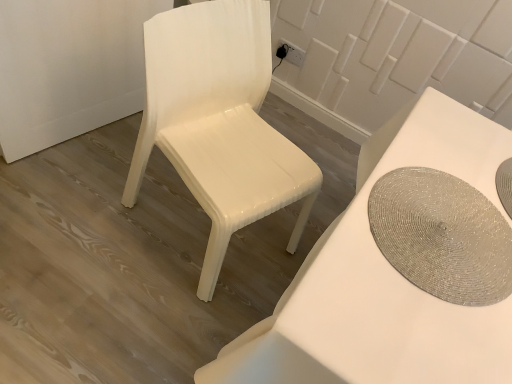
What are the coordinates of `shiny silver placemat at right` in the screenshot? It's located at (442, 236).

Locate an element on the screen. shiny silver placemat at right is located at coordinates (442, 236).

What's the angular difference between shiny silver placemat at right and white glossy chair at left's facing directions?

162 degrees.

Considering the positions of objects shiny silver placemat at right and white glossy chair at left in the image provided, who is in front, shiny silver placemat at right or white glossy chair at left?

shiny silver placemat at right.

Is shiny silver placemat at right facing towards white glossy chair at left?

Yes, shiny silver placemat at right faces towards white glossy chair at left.

Is white glossy chair at left completely or partially inside shiny silver placemat at right?

That's incorrect, white glossy chair at left is not inside shiny silver placemat at right.

Which is in front, white glossy table at center or white glossy chair at left?

white glossy table at center.

Is white glossy table at center bigger than white glossy chair at left?

Correct, white glossy table at center is larger in size than white glossy chair at left.

This screenshot has height=384, width=512. Find the location of `table to the right of white glossy chair at left`. table to the right of white glossy chair at left is located at coordinates (383, 280).

From a real-world perspective, which object stands above the other?

white glossy chair at left, from a real-world perspective.

Is white glossy chair at left far away from shiny silver placemat at right?

That's not correct — white glossy chair at left is a little close to shiny silver placemat at right.

Is point (200, 79) in front of point (486, 253)?

No, (200, 79) is further to viewer.

From a real-world perspective, is white glossy chair at left above or below white glossy table at center?

From a real-world perspective, white glossy chair at left is physically above white glossy table at center.

Considering the relative sizes of white glossy chair at left and white glossy table at center in the image provided, is white glossy chair at left taller than white glossy table at center?

Correct, white glossy chair at left is much taller as white glossy table at center.

Could white glossy table at center be considered to be inside white glossy chair at left?

No, white glossy table at center is not a part of white glossy chair at left.

Can you tell me how much white glossy chair at left and white glossy table at center differ in facing direction?

They differ by 69.4 degrees in their facing directions.

Is white glossy table at center facing away from shiny silver placemat at right?

No.

Which of these two, white glossy table at center or shiny silver placemat at right, is smaller?

With smaller size is shiny silver placemat at right.

Are white glossy table at center and shiny silver placemat at right located far from each other?

That's not correct — white glossy table at center is a little close to shiny silver placemat at right.

From a real-world perspective, does white glossy table at center stand above shiny silver placemat at right?

No, from a real-world perspective, white glossy table at center is not over shiny silver placemat at right

Considering the relative sizes of shiny silver placemat at right and white glossy table at center in the image provided, is shiny silver placemat at right smaller than white glossy table at center?

Indeed, shiny silver placemat at right has a smaller size compared to white glossy table at center.

Is white glossy table at center inside shiny silver placemat at right?

No, white glossy table at center is not surrounded by shiny silver placemat at right.

From a real-world perspective, which object stands above the other?

In real-world perspective, shiny silver placemat at right is above.

Which is closer to the camera, [437,234] or [258,374]?

Point [437,234] appears to be farther away from the viewer than point [258,374].

Where is `chair beneath the shiny silver placemat at right (from a real-world perspective)`? The height and width of the screenshot is (384, 512). chair beneath the shiny silver placemat at right (from a real-world perspective) is located at coordinates (219, 122).

Locate an element on the screen. This screenshot has width=512, height=384. table on the right side of white glossy chair at left is located at coordinates (383, 280).

Estimate the real-world distances between objects in this image. Which object is closer to white glossy chair at left, white glossy table at center or shiny silver placemat at right?

Among the two, white glossy table at center is located nearer to white glossy chair at left.

Estimate the real-world distances between objects in this image. Which object is closer to white glossy chair at left, shiny silver placemat at right or white glossy table at center?

Among the two, white glossy table at center is located nearer to white glossy chair at left.

Estimate the real-world distances between objects in this image. Which object is further from white glossy table at center, shiny silver placemat at right or white glossy chair at left?

white glossy chair at left is further to white glossy table at center.

Which object lies nearer to the anchor point shiny silver placemat at right, white glossy chair at left or white glossy table at center?

Based on the image, white glossy table at center appears to be nearer to shiny silver placemat at right.

Looking at the image, which one is located further to shiny silver placemat at right, white glossy table at center or white glossy chair at left?

Among the two, white glossy chair at left is located further to shiny silver placemat at right.

Based on their spatial positions, is white glossy chair at left or shiny silver placemat at right further from white glossy table at center?

The object further to white glossy table at center is white glossy chair at left.

The image size is (512, 384). Find the location of `round table between white glossy chair at left and white glossy table at center`. round table between white glossy chair at left and white glossy table at center is located at coordinates (442, 236).